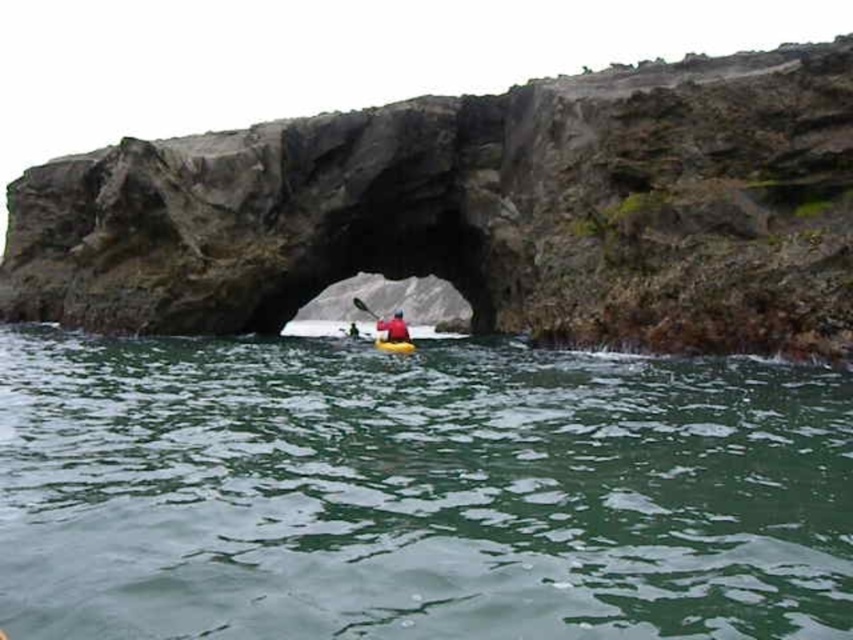
Can you confirm if dark gray rocky arch at center is positioned below yellow plastic paddle at center?

Actually, dark gray rocky arch at center is above yellow plastic paddle at center.

The height and width of the screenshot is (640, 853). I want to click on dark gray rocky arch at center, so click(x=480, y=211).

Where is `dark gray rocky arch at center`? dark gray rocky arch at center is located at coordinates (480, 211).

Is green water at center positioned before red fabric kayak at center?

Yes, it is.

Can you confirm if green water at center is taller than red fabric kayak at center?

In fact, green water at center may be shorter than red fabric kayak at center.

What do you see at coordinates (416, 492) in the screenshot? I see `green water at center` at bounding box center [416, 492].

You are a GUI agent. You are given a task and a screenshot of the screen. Output one action in this format:
    pyautogui.click(x=<x>, y=<y>)
    Task: Click on the green water at center
    
    Given the screenshot: What is the action you would take?
    pyautogui.click(x=416, y=492)

Which is more to the right, red fabric kayak at center or yellow kayak at center?

From the viewer's perspective, red fabric kayak at center appears more on the right side.

Locate an element on the screen. This screenshot has width=853, height=640. red fabric kayak at center is located at coordinates (393, 328).

The image size is (853, 640). I want to click on red fabric kayak at center, so click(x=393, y=328).